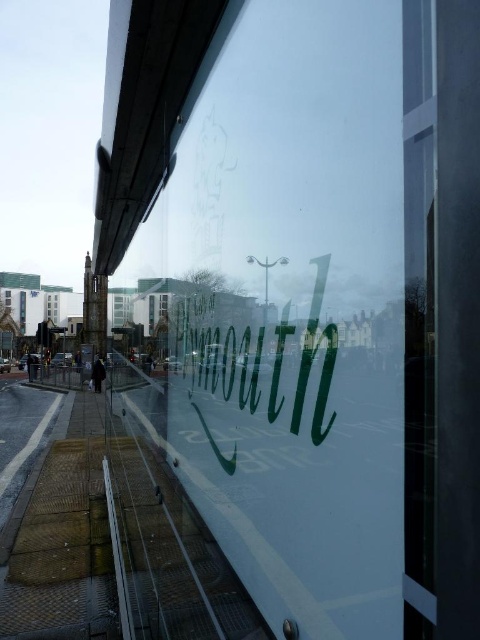
Is transparent glass sign at center positioned at the back of clear glass window at center?

That is False.

Looking at this image, who is more forward, (286,548) or (52,300)?

Point (286,548)

Locate an element on the screen. The height and width of the screenshot is (640, 480). transparent glass sign at center is located at coordinates (286, 289).

Between clear glass window at center and transparent glass window at center, which one appears on the right side from the viewer's perspective?

Positioned to the right is transparent glass window at center.

Which is in front, point (48, 298) or point (166, 316)?

Point (166, 316) is in front.

This screenshot has width=480, height=640. I want to click on clear glass window at center, so click(51, 307).

Does transparent glass sign at center have a larger size compared to transparent glass window at center?

Indeed, transparent glass sign at center has a larger size compared to transparent glass window at center.

Can you confirm if transparent glass sign at center is positioned above transparent glass window at center?

Yes, transparent glass sign at center is above transparent glass window at center.

Between point (260, 205) and point (166, 310), which one is positioned in front?

Point (260, 205)

Locate an element on the screen. Image resolution: width=480 pixels, height=640 pixels. transparent glass sign at center is located at coordinates (286, 289).